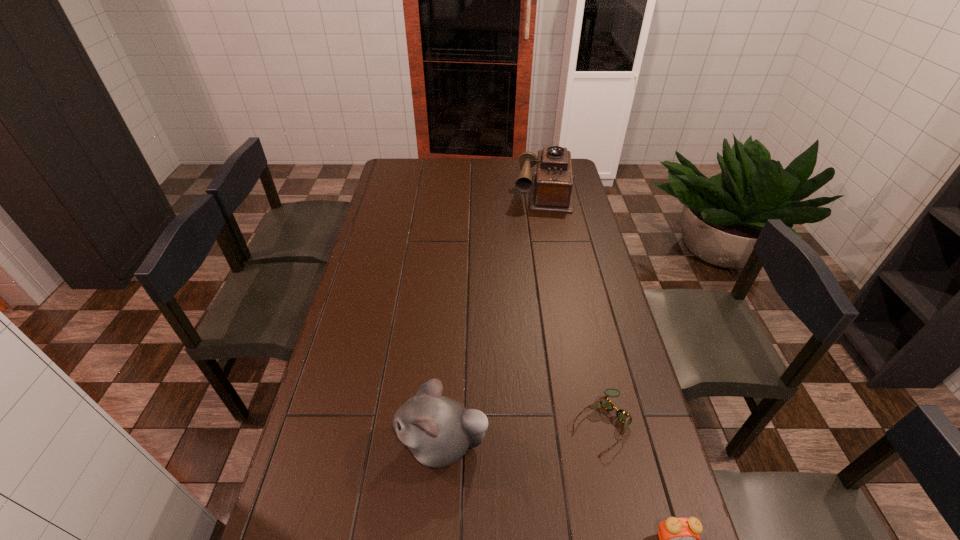
Locate an element on the screen. the leftmost object is located at coordinates (438, 430).

I want to click on spectacles, so click(x=622, y=415).

Locate an element on the screen. phonograph_record is located at coordinates (x=551, y=185).

This screenshot has width=960, height=540. What are the coordinates of `vacant space located on the face of the hamster` in the screenshot? It's located at (364, 444).

Find the location of `vacant area situated on the face of the hamster`. vacant area situated on the face of the hamster is located at coordinates (379, 444).

What are the coordinates of `free spot located on the face of the hamster` in the screenshot? It's located at (360, 444).

At what (x,y) coordinates should I click in order to perform the action: click on vacant region located 0.060m on the front-facing side of the shortest object. Please return your answer as a coordinate pair (x, y). Image resolution: width=960 pixels, height=540 pixels. Looking at the image, I should click on click(567, 461).

Identify the location of vacant space located 0.180m on the front-facing side of the shortest object. (536, 493).

This screenshot has height=540, width=960. In order to click on free location located 0.300m on the front-facing side of the shortest object in this screenshot , I will do click(500, 530).

I want to click on vacant region located on the horn of the farthest object, so click(542, 253).